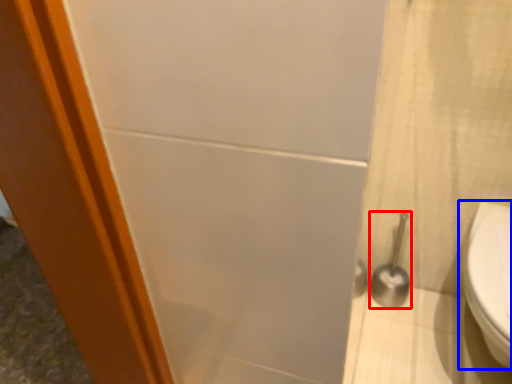
Question: Among these objects, which one is nearest to the camera, shower (highlighted by a red box) or toilet (highlighted by a blue box)?

Choices:
 (A) shower
 (B) toilet

Answer: (B)